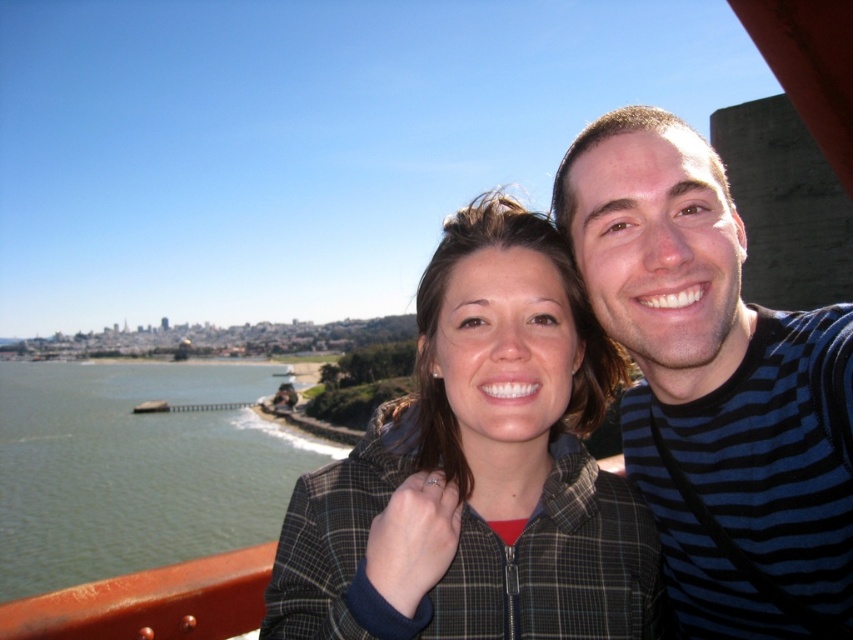
Question: Where is plaid jacket at center located in relation to green water at lower left in the image?

Choices:
 (A) right
 (B) left

Answer: (A)

Question: Does plaid jacket at center have a greater width compared to green water at lower left?

Choices:
 (A) no
 (B) yes

Answer: (A)

Question: Which of the following is the closest to the observer?

Choices:
 (A) green water at lower left
 (B) plaid jacket at center

Answer: (B)

Question: Does blue striped shirt at upper right have a larger size compared to green water at lower left?

Choices:
 (A) no
 (B) yes

Answer: (A)

Question: Estimate the real-world distances between objects in this image. Which object is farther from the plaid jacket at center?

Choices:
 (A) green water at lower left
 (B) blue striped shirt at upper right

Answer: (A)

Question: Among these points, which one is farthest from the camera?

Choices:
 (A) (250, 524)
 (B) (524, 276)
 (C) (718, 420)

Answer: (A)